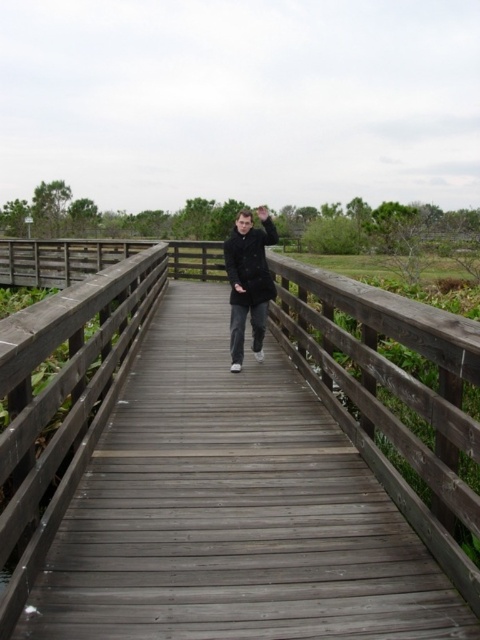
You are standing on the wooden boardwalk and see the wooden bridge at center and the matte black coat at center. Which object is closer to you?

The wooden bridge at center is closer to you because it is in front of the matte black coat at center.

You are standing on the wooden boardwalk and want to cross to the other side. The wooden bridge at center and the matte black coat at center are in your path. Which object should you avoid stepping on to reach the other side safely?

You should avoid stepping on the matte black coat at center because it is an object worn by a person, while the wooden bridge at center is the structure you should use to cross safely.

You are standing on the wooden boardwalk and notice a specific point marked at coordinates (69, 372). Based on the scene description, where exactly is this point located?

The point at (69, 372) is located on the wooden bridge at center.